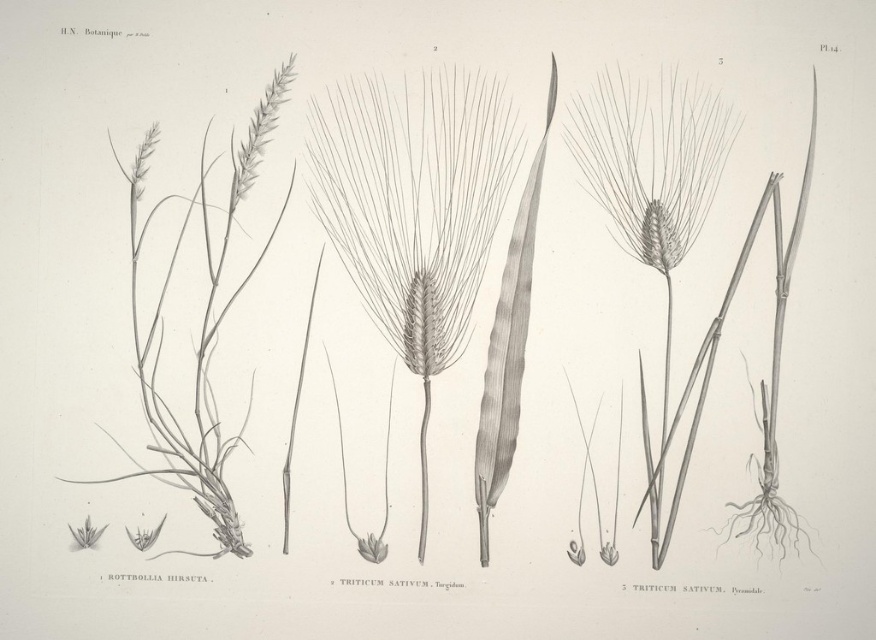
Question: Can you confirm if gray textured wheat ear at center is smaller than smooth gray wheat ear at center?

Choices:
 (A) yes
 (B) no

Answer: (B)

Question: Does gray textured wheat ear at center have a smaller size compared to smooth gray wheat ear at center?

Choices:
 (A) yes
 (B) no

Answer: (B)

Question: Is gray textured wheat ear at center wider than smooth gray wheat ear at center?

Choices:
 (A) yes
 (B) no

Answer: (A)

Question: Among these points, which one is farthest from the camera?

Choices:
 (A) (415, 200)
 (B) (716, 150)

Answer: (A)

Question: Which point appears closest to the camera in this image?

Choices:
 (A) (467, 163)
 (B) (576, 102)

Answer: (B)